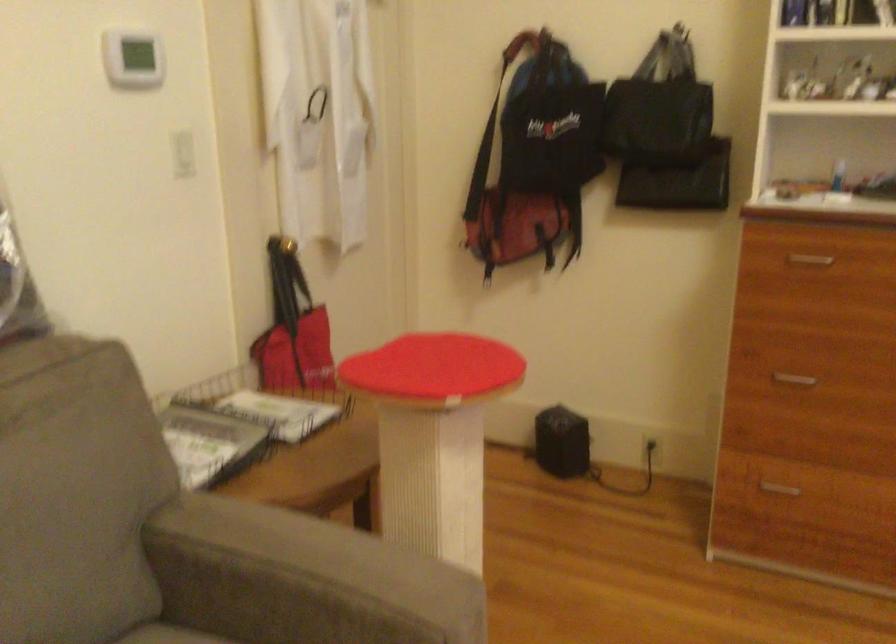
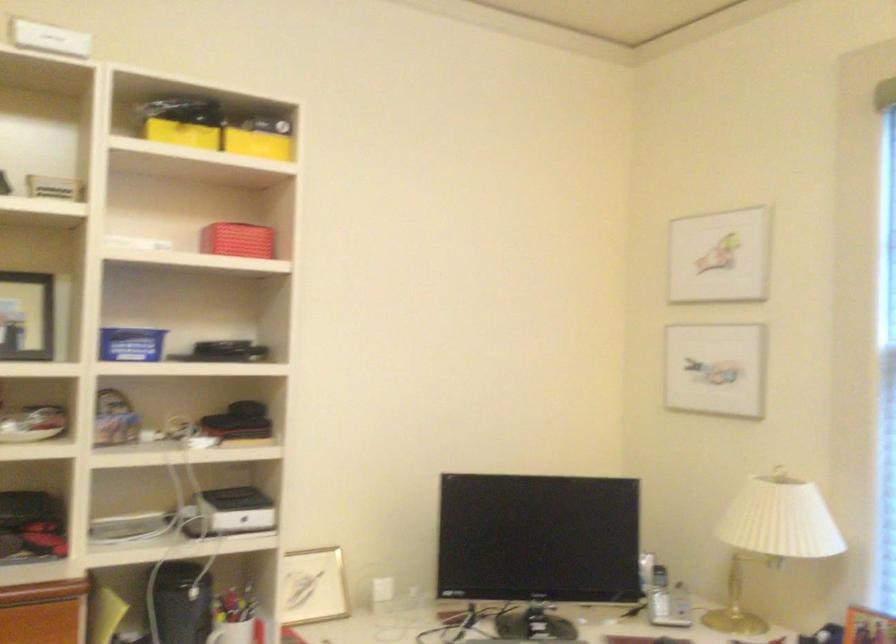
Question: The first image is from the beginning of the video and the second image is from the end. How did the camera likely rotate when shooting the video?

Choices:
 (A) Left
 (B) Right
 (C) Up
 (D) Down

Answer: (B)